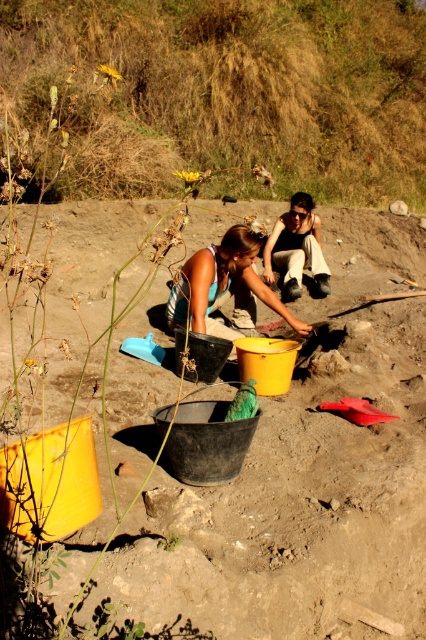
You are an archaeologist at the site and need to store some artifacts. You have a yellow matte bucket at center and a matte black pants at center available. Which object can you use to store items that require a taller container?

The matte black pants at center is taller than the yellow matte bucket at center, so you should use the matte black pants at center to store items that require a taller container.

In the scene shown: You are an archaeologist working at the excavation site. You need to move the yellow matte bucket at center to the right side of the matte black pants at center. Is the bucket currently positioned where you need it to be?

The yellow matte bucket at center is positioned on the left side of matte black pants at center, so it is not currently where you need it to be. You need to move it to the right side of the matte black pants at center.